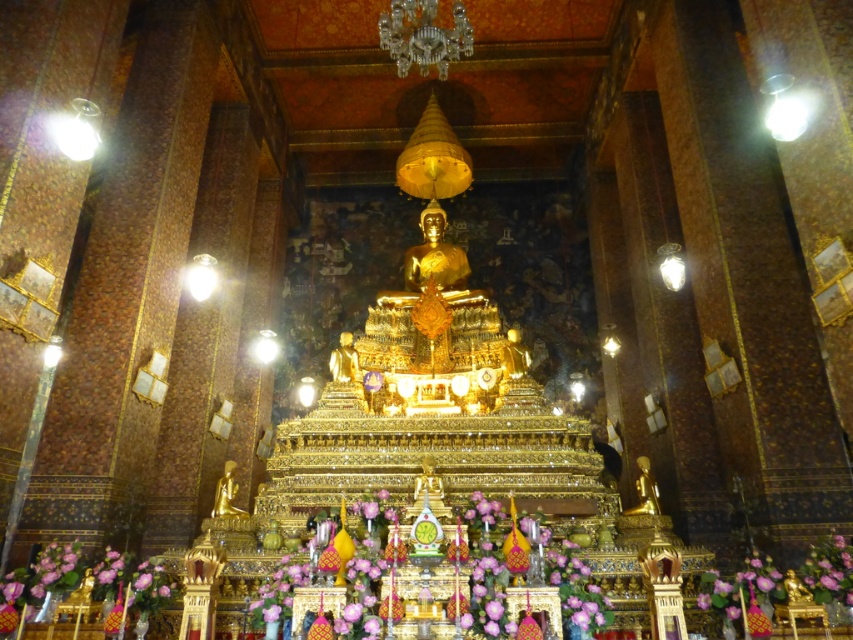
Which is more to the right, purple silk flower at center or gold polished statue at center?

purple silk flower at center is more to the right.

Is purple silk flower at center further to camera compared to gold polished statue at center?

No, it is not.

Between point (827, 554) and point (228, 496), which one is positioned in front?

Point (827, 554) is more forward.

Locate an element on the screen. The height and width of the screenshot is (640, 853). purple silk flower at center is located at coordinates (828, 570).

Is purple silk flowers at center to the right of gold polished statue at center from the viewer's perspective?

Yes, purple silk flowers at center is to the right of gold polished statue at center.

Is purple silk flowers at center below gold polished statue at center?

No.

From the picture: Who is more distant from viewer, [555,577] or [241,509]?

Positioned behind is point [241,509].

Where is `purple silk flowers at center`? The image size is (853, 640). purple silk flowers at center is located at coordinates (482, 566).

Is gold shiny statue at center to the left of gold polished statue at center from the viewer's perspective?

In fact, gold shiny statue at center is to the right of gold polished statue at center.

Is gold shiny statue at center thinner than gold polished statue at center?

No.

Is point (648, 499) positioned in front of point (236, 486)?

Yes, it is in front of point (236, 486).

What are the coordinates of `gold shiny statue at center` in the screenshot? It's located at (643, 490).